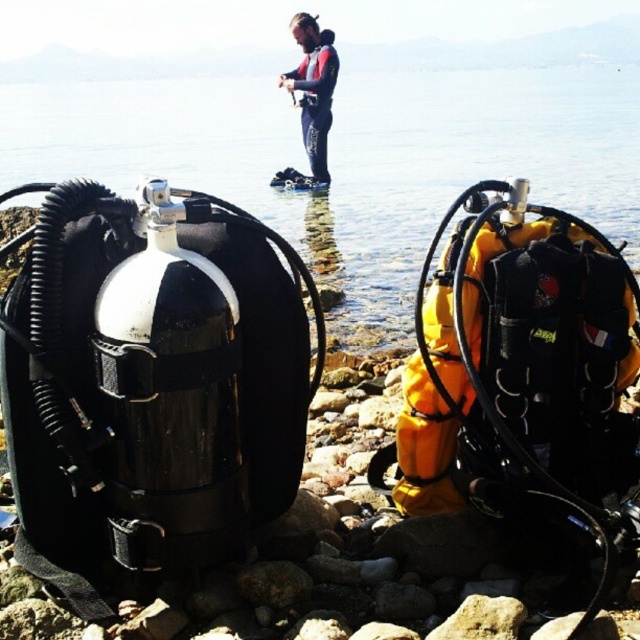
Which is in front, point (316, 196) or point (305, 70)?

Point (316, 196) is in front.

In order to click on transparent water at center in this screenshot , I will do `click(349, 160)`.

Which is behind, point (300, 252) or point (300, 36)?

Positioned behind is point (300, 36).

The image size is (640, 640). What are the coordinates of `transparent water at center` in the screenshot? It's located at (349, 160).